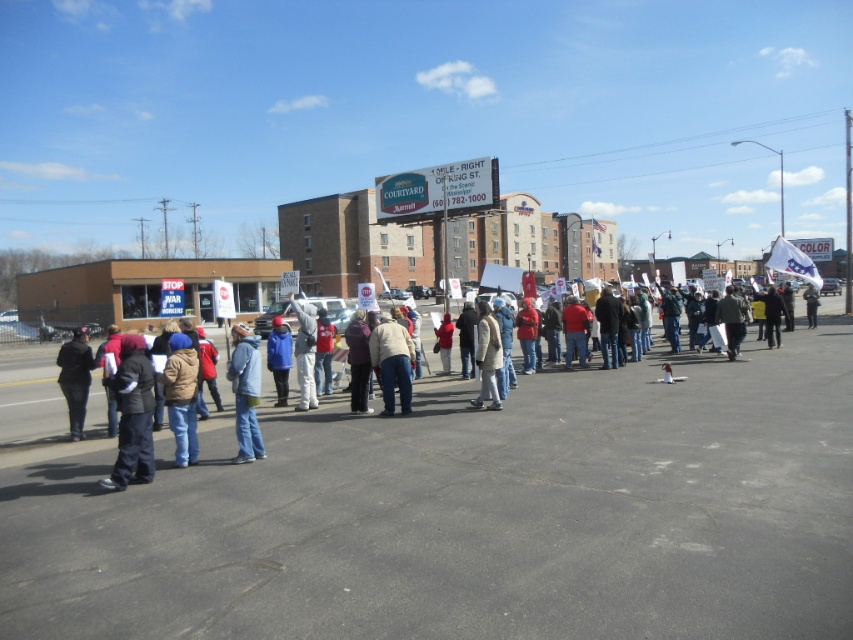
Can you confirm if black leather jacket at left is positioned below blue fleece jacket at center?

Correct, black leather jacket at left is located below blue fleece jacket at center.

Is black leather jacket at left thinner than blue fleece jacket at center?

In fact, black leather jacket at left might be wider than blue fleece jacket at center.

Image resolution: width=853 pixels, height=640 pixels. Describe the element at coordinates (74, 378) in the screenshot. I see `black leather jacket at left` at that location.

At what (x,y) coordinates should I click in order to perform the action: click on black leather jacket at left. Please return your answer as a coordinate pair (x, y). Looking at the image, I should click on (74, 378).

From the picture: Who is lower down, brown fuzzy jacket at lower left or white matte jacket at center?

brown fuzzy jacket at lower left is below.

The image size is (853, 640). What do you see at coordinates (181, 396) in the screenshot?
I see `brown fuzzy jacket at lower left` at bounding box center [181, 396].

Find the location of a particular element. This screenshot has height=640, width=853. brown fuzzy jacket at lower left is located at coordinates (181, 396).

Based on the photo, which is more to the left, blue denim jeans at lower left or white matte jacket at center?

blue denim jeans at lower left is more to the left.

Which is in front, point (236, 365) or point (486, 323)?

Point (236, 365) is in front.

This screenshot has width=853, height=640. What are the coordinates of `blue denim jeans at lower left` in the screenshot? It's located at (245, 392).